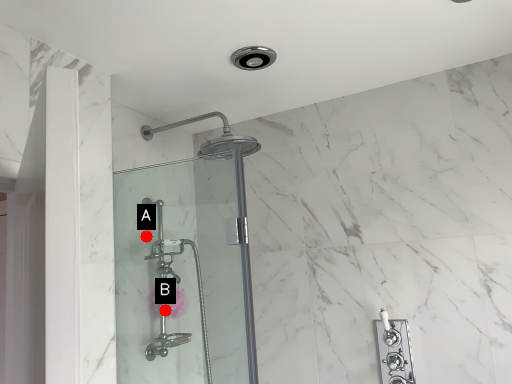
Question: Two points are circled on the image, labeled by A and B beside each circle. Among these points, which one is nearest to the camera?

Choices:
 (A) A is closer
 (B) B is closer

Answer: (B)